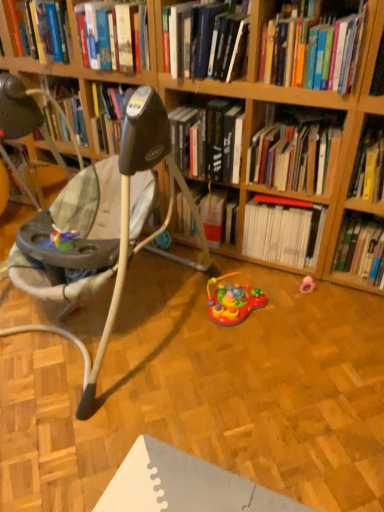
Where is `vacant area that lies to the right of beige fabric baby swing at left`? vacant area that lies to the right of beige fabric baby swing at left is located at coordinates (273, 352).